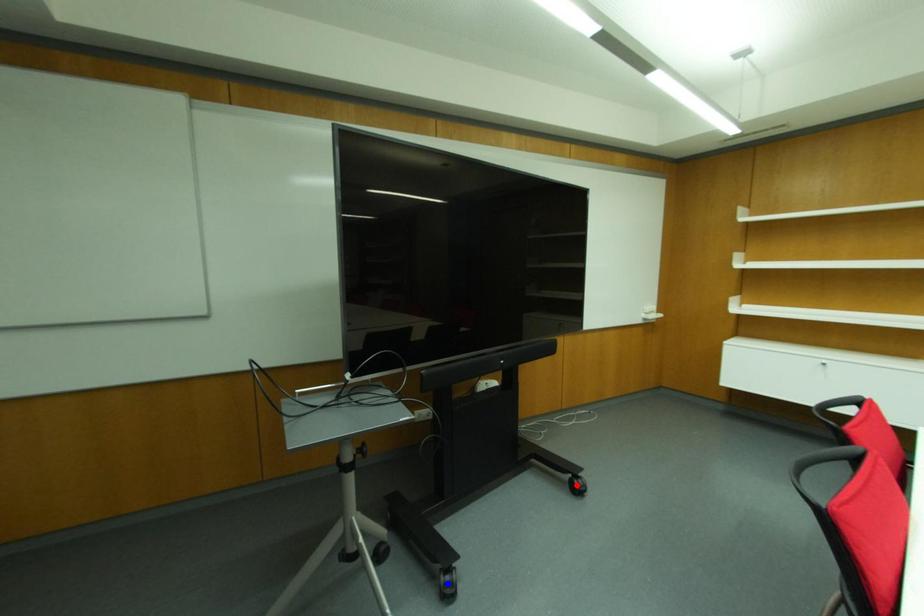
Question: In the image, two points are highlighted. Which point is nearer to the camera? Reply with the corresponding letter.

Choices:
 (A) blue point
 (B) red point

Answer: (A)